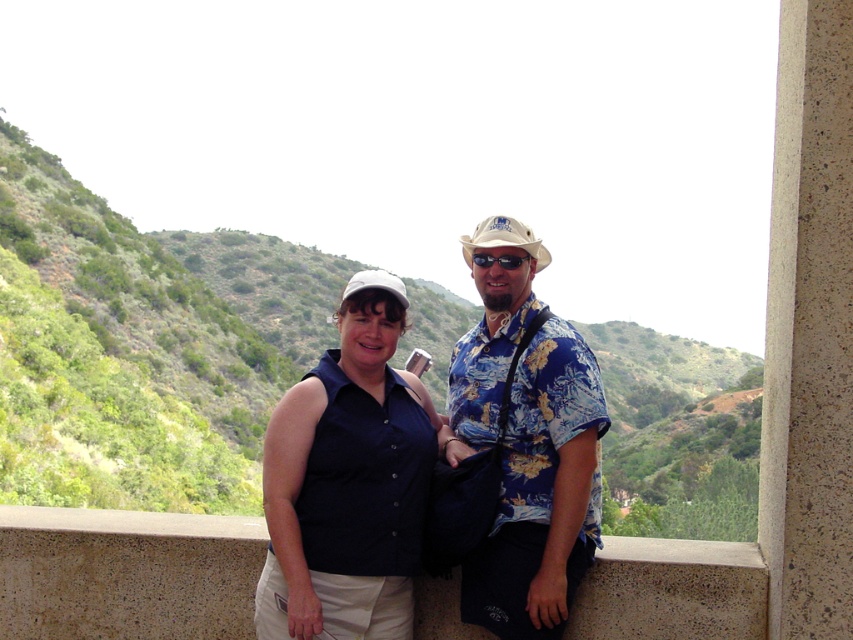
Is the position of blue floral shirt at center more distant than that of black plastic goggles at center?

No, blue floral shirt at center is in front of black plastic goggles at center.

Between blue floral shirt at center and black plastic goggles at center, which one has more height?

Standing taller between the two is blue floral shirt at center.

Where is `blue floral shirt at center`? The height and width of the screenshot is (640, 853). blue floral shirt at center is located at coordinates (543, 492).

I want to click on blue floral shirt at center, so click(543, 492).

Identify the location of green leafy hillside at upper left. This screenshot has height=640, width=853. (141, 346).

From the picture: Is green leafy hillside at upper left closer to camera compared to concrete ledge at center?

No, green leafy hillside at upper left is behind concrete ledge at center.

Image resolution: width=853 pixels, height=640 pixels. In order to click on green leafy hillside at upper left in this screenshot , I will do `click(141, 346)`.

The height and width of the screenshot is (640, 853). In order to click on green leafy hillside at upper left in this screenshot , I will do `click(141, 346)`.

Which is behind, point (648, 403) or point (543, 570)?

The point (648, 403) is more distant.

Can you confirm if green leafy hillside at upper left is positioned to the right of blue floral shirt at center?

No, green leafy hillside at upper left is not to the right of blue floral shirt at center.

Identify the location of green leafy hillside at upper left. This screenshot has height=640, width=853. (141, 346).

At what (x,y) coordinates should I click in order to perform the action: click on green leafy hillside at upper left. Please return your answer as a coordinate pair (x, y). This screenshot has width=853, height=640. Looking at the image, I should click on (141, 346).